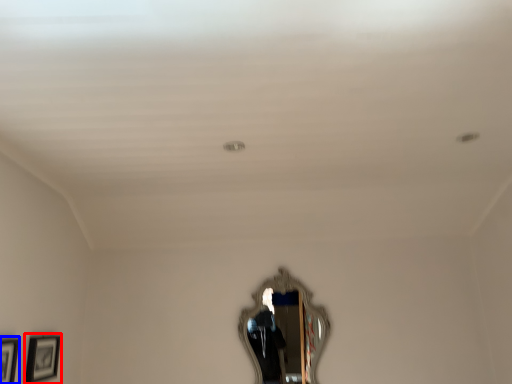
Question: Which object is further to the camera taking this photo, picture frame (highlighted by a red box) or picture frame (highlighted by a blue box)?

Choices:
 (A) picture frame
 (B) picture frame

Answer: (A)